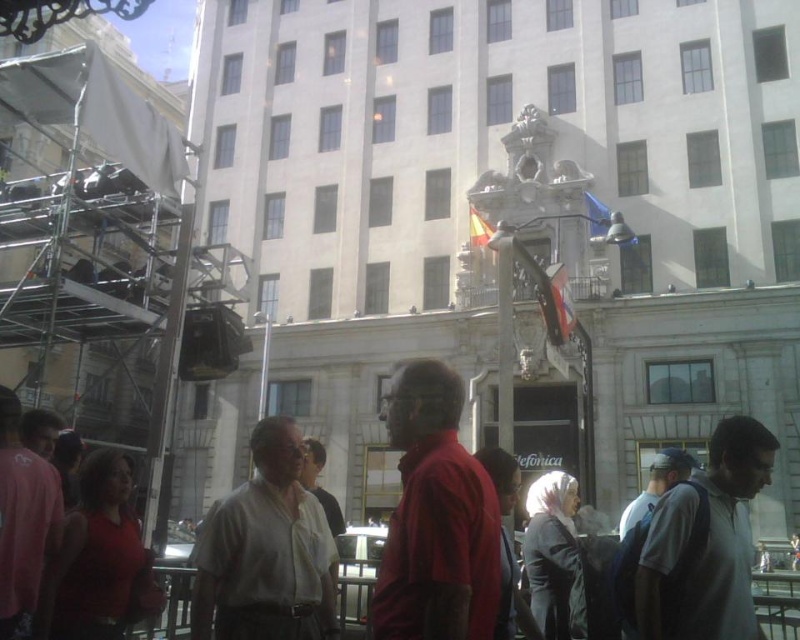
How distant is matte red shirt at center from light brown shirt at center?

They are 6.56 meters apart.

Is matte red shirt at center wider than light brown shirt at center?

No, matte red shirt at center is not wider than light brown shirt at center.

Which is behind, point (400, 598) or point (229, 572)?

Positioned behind is point (229, 572).

Where is `matte red shirt at center`? This screenshot has height=640, width=800. matte red shirt at center is located at coordinates (436, 516).

Between matte red shirt at center and gray fabric backpack at lower right, which one is positioned higher?

matte red shirt at center is above.

Who is taller, matte red shirt at center or gray fabric backpack at lower right?

matte red shirt at center is taller.

Who is more forward, (442,497) or (712,637)?

Positioned in front is point (442,497).

Where is `matte red shirt at center`? This screenshot has width=800, height=640. matte red shirt at center is located at coordinates (436, 516).

Who is positioned more to the right, light brown shirt at center or gray fabric backpack at lower right?

gray fabric backpack at lower right

Can you confirm if light brown shirt at center is shorter than gray fabric backpack at lower right?

No, light brown shirt at center is not shorter than gray fabric backpack at lower right.

Image resolution: width=800 pixels, height=640 pixels. In order to click on light brown shirt at center in this screenshot , I will do `click(266, 550)`.